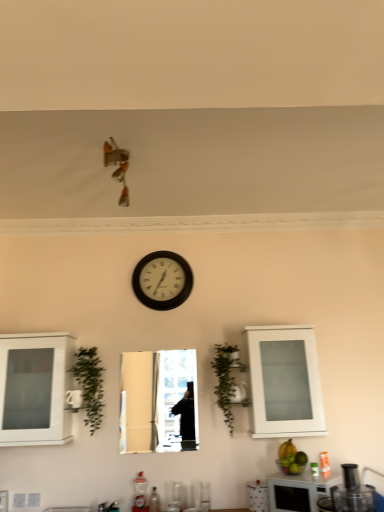
How much space does black plastic food processor at lower right, acting as the 2th appliance starting from the back, occupy horizontally?

black plastic food processor at lower right, acting as the 2th appliance starting from the back, is 14.78 inches wide.

In order to click on green leafy plant at left, the 1th plant when ordered from left to right in this screenshot , I will do `click(90, 385)`.

This screenshot has height=512, width=384. Describe the element at coordinates (35, 389) in the screenshot. I see `white matte cabinet at left, which ranks as the first cabinetry in left-to-right order` at that location.

Measure the distance between yellow matte bananas at lower right and camera.

yellow matte bananas at lower right is 10.04 feet from camera.

Measure the distance between point (230, 394) and camera.

The distance of point (230, 394) from camera is 3.29 meters.

Locate an element on the screen. The width and height of the screenshot is (384, 512). black plastic food processor at lower right, the 2th appliance ordered from the bottom is located at coordinates (352, 492).

Considering the relative sizes of black plastic food processor at lower right, the 2th appliance ordered from the bottom, and black matte microwave at lower right, which is counted as the 2th appliance, starting from the top, in the image provided, is black plastic food processor at lower right, the 2th appliance ordered from the bottom, wider than black matte microwave at lower right, which is counted as the 2th appliance, starting from the top,?

Indeed, black plastic food processor at lower right, the 2th appliance ordered from the bottom, has a greater width compared to black matte microwave at lower right, which is counted as the 2th appliance, starting from the top.

Is black plastic food processor at lower right, which ranks as the first appliance in front-to-back order, inside or outside of black matte microwave at lower right, the second appliance viewed from the front?

black plastic food processor at lower right, which ranks as the first appliance in front-to-back order, exists outside the volume of black matte microwave at lower right, the second appliance viewed from the front.

Is the depth of black plastic food processor at lower right, which ranks as the first appliance in front-to-back order, greater than that of black matte microwave at lower right, the second appliance viewed from the front?

No, it is not.

How different are the orientations of black plastic food processor at lower right, which is counted as the first appliance, starting from the top, and black matte microwave at lower right, which is counted as the 2th appliance, starting from the top, in degrees?

black plastic food processor at lower right, which is counted as the first appliance, starting from the top, and black matte microwave at lower right, which is counted as the 2th appliance, starting from the top, are facing 47.8 degrees away from each other.

Is black matte microwave at lower right, acting as the 1th appliance starting from the bottom, at the right side of green leafy plant at center, the first plant in the right-to-left sequence?

Yes, black matte microwave at lower right, acting as the 1th appliance starting from the bottom, is to the right of green leafy plant at center, the first plant in the right-to-left sequence.

From the image's perspective, would you say black matte microwave at lower right, the second appliance viewed from the front, is shown under green leafy plant at center, the first plant in the right-to-left sequence?

Indeed, from the image's perspective, black matte microwave at lower right, the second appliance viewed from the front, is shown beneath green leafy plant at center, the first plant in the right-to-left sequence.

Is black matte microwave at lower right, acting as the 1th appliance starting from the bottom, facing away from green leafy plant at center, placed as the second plant when sorted from left to right?

black matte microwave at lower right, acting as the 1th appliance starting from the bottom, does not have its back to green leafy plant at center, placed as the second plant when sorted from left to right.

Is black matte microwave at lower right, which is counted as the 2th appliance, starting from the top, not near green leafy plant at center, the first plant in the right-to-left sequence?

black matte microwave at lower right, which is counted as the 2th appliance, starting from the top, is actually quite close to green leafy plant at center, the first plant in the right-to-left sequence.

Between yellow matte bananas at lower right and black plastic food processor at lower right, acting as the 2th appliance starting from the back, which one has less height?

With less height is yellow matte bananas at lower right.

Between yellow matte bananas at lower right and black plastic food processor at lower right, which ranks as the first appliance in front-to-back order, which one appears on the right side from the viewer's perspective?

black plastic food processor at lower right, which ranks as the first appliance in front-to-back order, is more to the right.

Is yellow matte bananas at lower right far away from black plastic food processor at lower right, the 2th appliance ordered from the bottom?

No, yellow matte bananas at lower right is in close proximity to black plastic food processor at lower right, the 2th appliance ordered from the bottom.

Which is in front, point (293, 449) or point (346, 467)?

The point (346, 467) is in front.

From the image's perspective, is black plastic food processor at lower right, the 2th appliance ordered from the bottom, above yellow matte bananas at lower right?

Yes, from the image's perspective, black plastic food processor at lower right, the 2th appliance ordered from the bottom, is above yellow matte bananas at lower right.

The width and height of the screenshot is (384, 512). What are the coordinates of `fruit to the left of black plastic food processor at lower right, which is counted as the first appliance, starting from the top` in the screenshot? It's located at (287, 449).

Is yellow matte bananas at lower right inside black plastic food processor at lower right, acting as the 2th appliance starting from the back?

No, yellow matte bananas at lower right is not a part of black plastic food processor at lower right, acting as the 2th appliance starting from the back.

Is black matte microwave at lower right, the second appliance viewed from the front, to the left of green leafy plant at left, the 1th plant when ordered from left to right, from the viewer's perspective?

No.

Is black matte microwave at lower right, which is counted as the 2th appliance, starting from the top, closer to the viewer compared to green leafy plant at left, the 1th plant when ordered from left to right?

Yes, it is in front of green leafy plant at left, the 1th plant when ordered from left to right.

Is black matte microwave at lower right, the 1th appliance viewed from the back, oriented away from green leafy plant at left, the 1th plant when ordered from left to right?

No.

Can you confirm if black matte microwave at lower right, the second appliance viewed from the front, is taller than green leafy plant at left, the 1th plant when ordered from left to right?

Incorrect, the height of black matte microwave at lower right, the second appliance viewed from the front, is not larger of that of green leafy plant at left, the 1th plant when ordered from left to right.

Is green leafy plant at center, the first plant in the right-to-left sequence, far from wooden wall clock at center?

That's not correct — green leafy plant at center, the first plant in the right-to-left sequence, is a little close to wooden wall clock at center.

How different are the orientations of green leafy plant at center, placed as the second plant when sorted from left to right, and wooden wall clock at center in degrees?

0.000198 degrees separate the facing orientations of green leafy plant at center, placed as the second plant when sorted from left to right, and wooden wall clock at center.

In the image, is green leafy plant at center, the first plant in the right-to-left sequence, on the left side or the right side of wooden wall clock at center?

In the image, green leafy plant at center, the first plant in the right-to-left sequence, appears on the right side of wooden wall clock at center.

At what (x,y) coordinates should I click in order to perform the action: click on the 1st plant in front of the wooden wall clock at center, counting from the anchor's position. Please return your answer as a coordinate pair (x, y). The image size is (384, 512). Looking at the image, I should click on (224, 381).

Considering the points (177, 270) and (49, 423), which point is in front, point (177, 270) or point (49, 423)?

Point (49, 423)

Which object is wider, wooden wall clock at center or white matte cabinet at left, the 2th cabinetry when ordered from right to left?

white matte cabinet at left, the 2th cabinetry when ordered from right to left.

Would you consider wooden wall clock at center to be distant from white matte cabinet at left, the 2th cabinetry when ordered from right to left?

No, wooden wall clock at center is not far away from white matte cabinet at left, the 2th cabinetry when ordered from right to left.

At what (x,y) coordinates should I click in order to perform the action: click on appliance on the left of black plastic food processor at lower right, which is counted as the first appliance, starting from the top. Please return your answer as a coordinate pair (x, y). Looking at the image, I should click on (299, 490).

At what (x,y) coordinates should I click in order to perform the action: click on appliance that is the 2nd one when counting downward from the green leafy plant at center, placed as the second plant when sorted from left to right (from the image's perspective). Please return your answer as a coordinate pair (x, y). The width and height of the screenshot is (384, 512). Looking at the image, I should click on (299, 490).

When comparing their distances from white matte cabinet at left, the 2th cabinetry when ordered from right to left, does black plastic food processor at lower right, which is counted as the first appliance, starting from the top, or wooden wall clock at center seem closer?

wooden wall clock at center lies closer to white matte cabinet at left, the 2th cabinetry when ordered from right to left, than the other object.

Based on their spatial positions, is metallic reflective mirror at center or black matte microwave at lower right, the second appliance viewed from the front, closer to green leafy plant at center, placed as the second plant when sorted from left to right?

metallic reflective mirror at center lies closer to green leafy plant at center, placed as the second plant when sorted from left to right, than the other object.

Looking at the image, which one is located further to metallic reflective mirror at center, yellow matte bananas at lower right or wooden wall clock at center?

Based on the image, yellow matte bananas at lower right appears to be further to metallic reflective mirror at center.

Estimate the real-world distances between objects in this image. Which object is further from yellow matte bananas at lower right, green leafy plant at left, the 1th plant when ordered from left to right, or black matte microwave at lower right, the second appliance viewed from the front?

The object further to yellow matte bananas at lower right is green leafy plant at left, the 1th plant when ordered from left to right.

From the image, which object appears to be nearer to black matte microwave at lower right, the 1th appliance viewed from the back, wooden wall clock at center or metallic reflective mirror at center?

Among the two, metallic reflective mirror at center is located nearer to black matte microwave at lower right, the 1th appliance viewed from the back.

Which object lies nearer to the anchor point white matte cabinet at left, the 2th cabinetry when ordered from right to left, green leafy plant at left, which is counted as the 2th plant, starting from the right, or black plastic food processor at lower right, acting as the 2th appliance starting from the back?

The object closer to white matte cabinet at left, the 2th cabinetry when ordered from right to left, is green leafy plant at left, which is counted as the 2th plant, starting from the right.

From the image, which object appears to be nearer to black matte microwave at lower right, which is counted as the 2th appliance, starting from the top, yellow matte bananas at lower right or white matte cabinet at left, the 2th cabinetry when ordered from right to left?

yellow matte bananas at lower right is closer to black matte microwave at lower right, which is counted as the 2th appliance, starting from the top.

Which object lies nearer to the anchor point metallic reflective mirror at center, green leafy plant at center, placed as the second plant when sorted from left to right, or yellow matte bananas at lower right?

Among the two, green leafy plant at center, placed as the second plant when sorted from left to right, is located nearer to metallic reflective mirror at center.

In order to click on fruit between black plastic food processor at lower right, which is counted as the first appliance, starting from the top, and wooden wall clock at center in the front-back direction in this screenshot , I will do `click(287, 449)`.

Find the location of a particular element. fruit situated between metallic reflective mirror at center and black matte microwave at lower right, acting as the 1th appliance starting from the bottom, from left to right is located at coordinates (287, 449).

This screenshot has width=384, height=512. In order to click on fruit between green leafy plant at left, the 1th plant when ordered from left to right, and black matte microwave at lower right, acting as the 1th appliance starting from the bottom, in the horizontal direction in this screenshot , I will do pos(287,449).

Find the location of `mirror between green leafy plant at left, the 1th plant when ordered from left to right, and yellow matte bananas at lower right from left to right`. mirror between green leafy plant at left, the 1th plant when ordered from left to right, and yellow matte bananas at lower right from left to right is located at coordinates (157, 401).